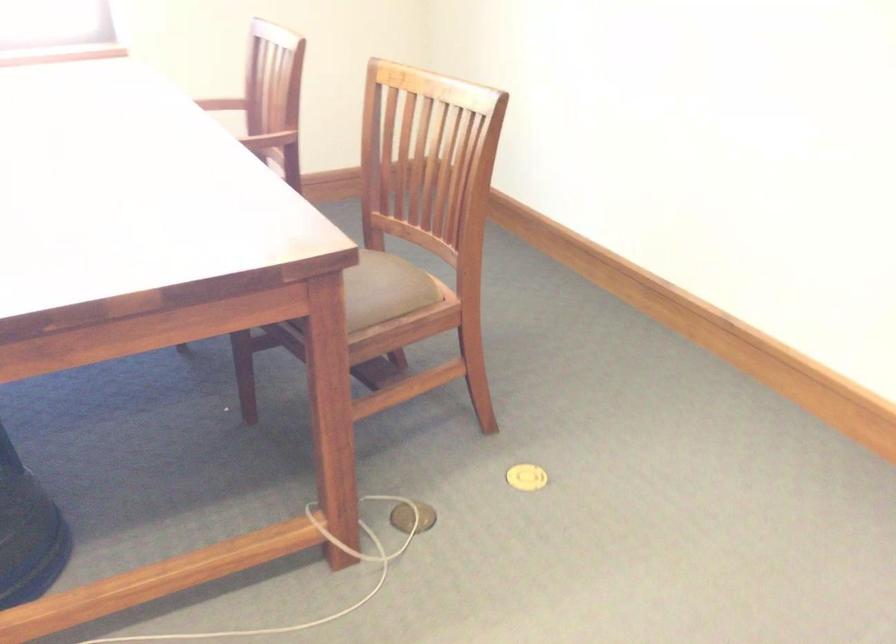
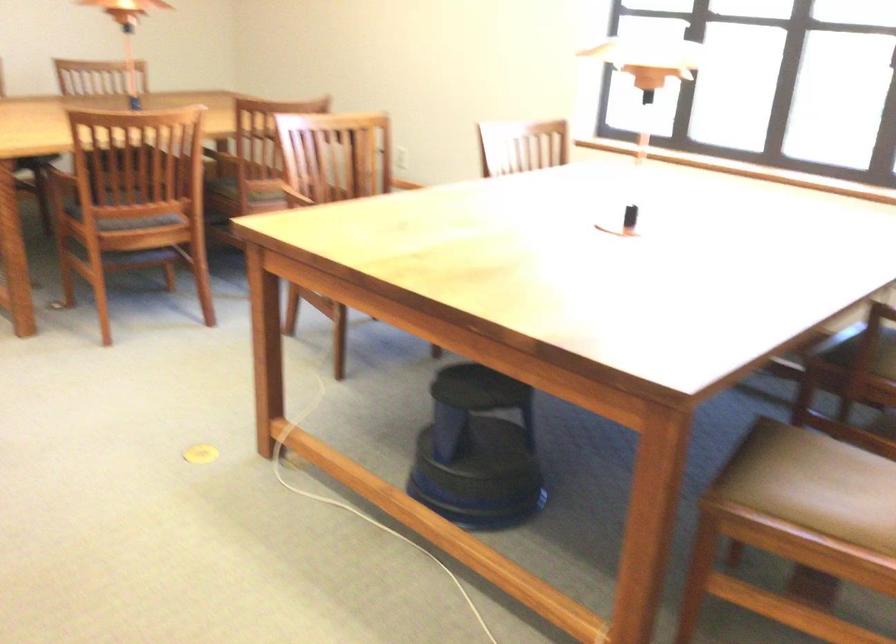
The point at (348, 289) is marked in the first image. Where is the corresponding point in the second image?

(824, 478)